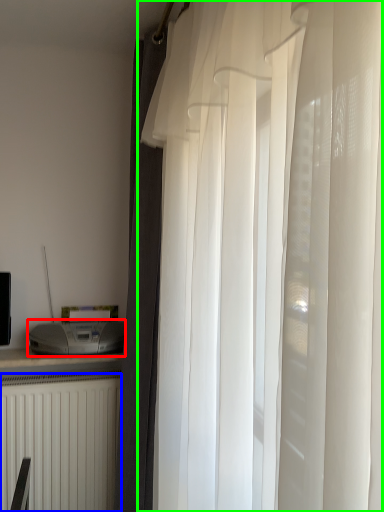
Question: Which object is positioned closest to appliance (highlighted by a red box)? Select from radiator (highlighted by a blue box) and curtain (highlighted by a green box).

Choices:
 (A) radiator
 (B) curtain

Answer: (A)